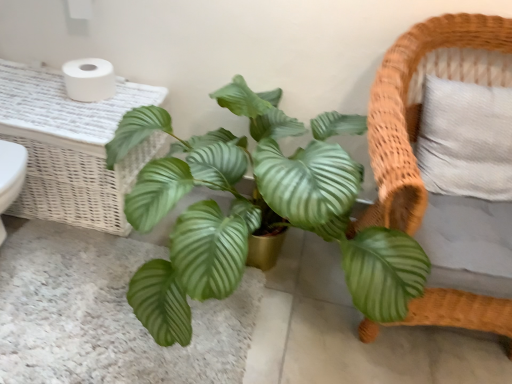
Question: Is white matte toilet paper at upper left situated inside green glossy leaf at center or outside?

Choices:
 (A) outside
 (B) inside

Answer: (A)

Question: In terms of width, does white matte toilet paper at upper left look wider or thinner when compared to green glossy leaf at center?

Choices:
 (A) wide
 (B) thin

Answer: (B)

Question: Based on their relative distances, which object is nearer to the white wicker table at upper left?

Choices:
 (A) white matte toilet paper at upper left
 (B) green glossy leafy plant at center
 (C) woven wood chair at right
 (D) green glossy leaf at center

Answer: (A)

Question: Considering the real-world distances, which object is closest to the green glossy leafy plant at center?

Choices:
 (A) green glossy leaf at center
 (B) white matte toilet paper at upper left
 (C) white wicker table at upper left
 (D) woven wood chair at right

Answer: (D)